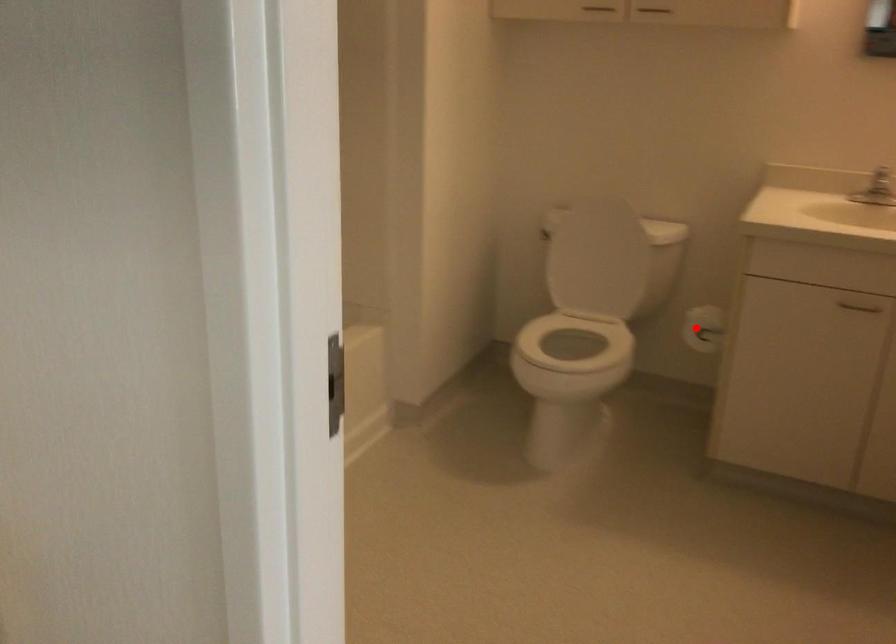
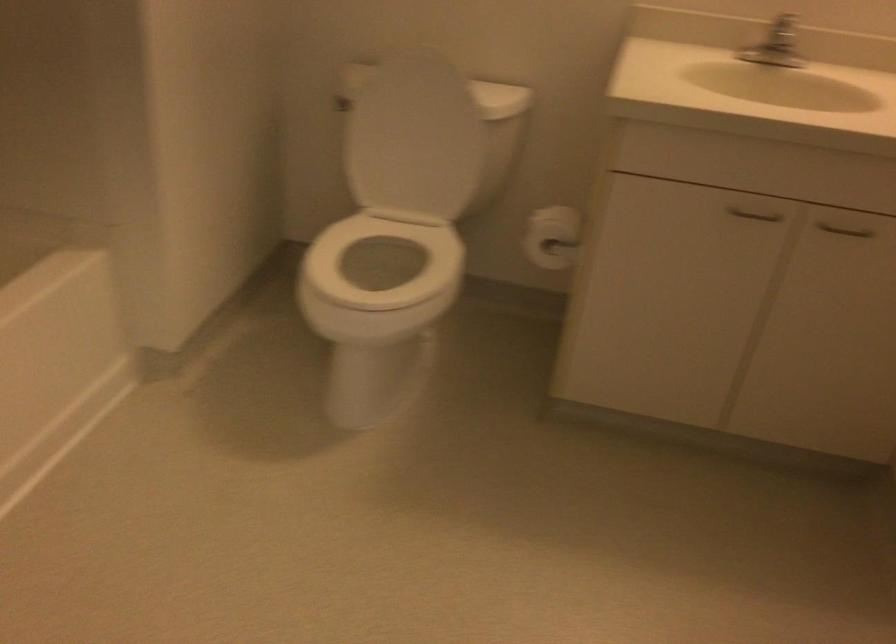
Question: I am providing you with two images of the same scene from different viewpoints. Given a red point in image1, look at the same physical point in image2. Is it:

Choices:
 (A) Closer to the viewpoint
 (B) Farther from the viewpoint

Answer: (A)